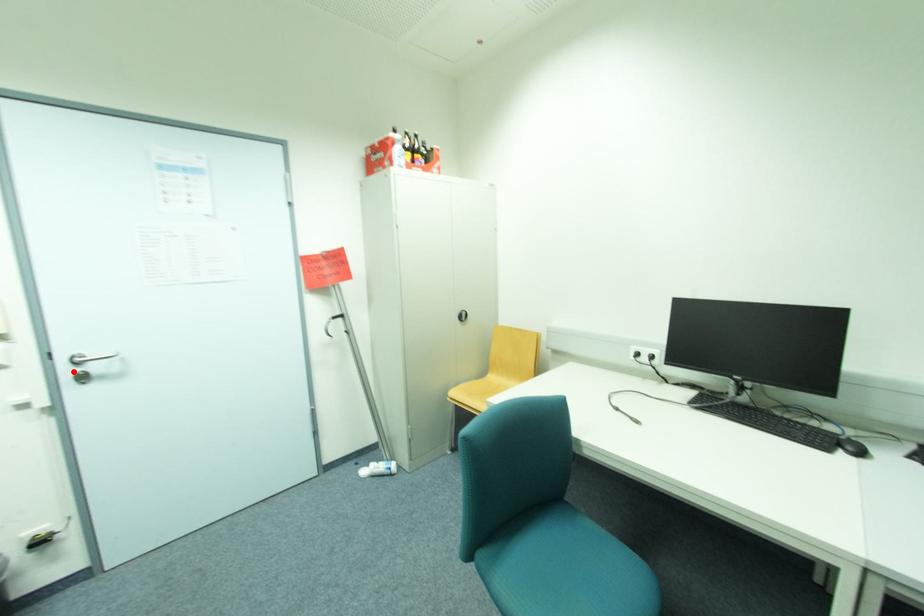
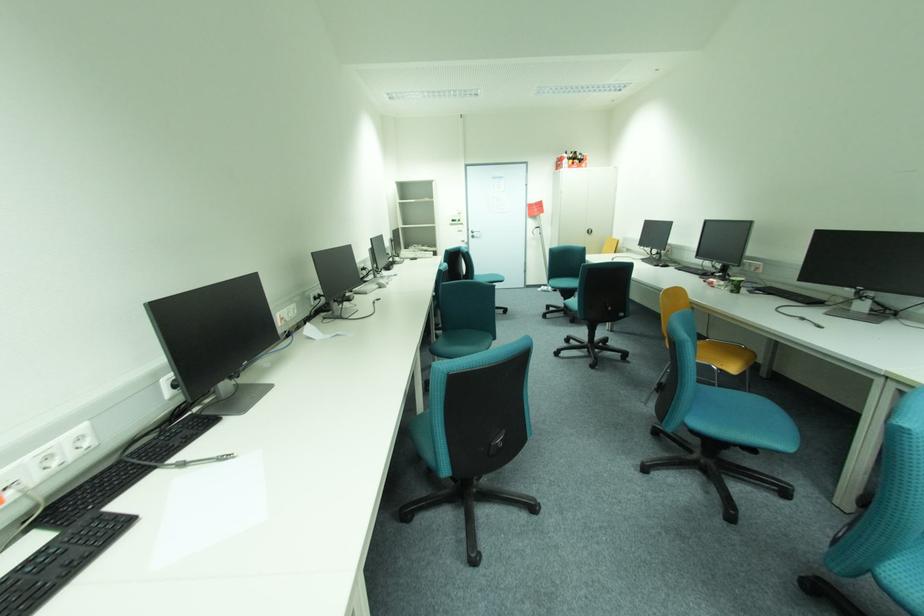
Find the pixel in the second image that matches the highlighted location in the first image.

(477, 235)